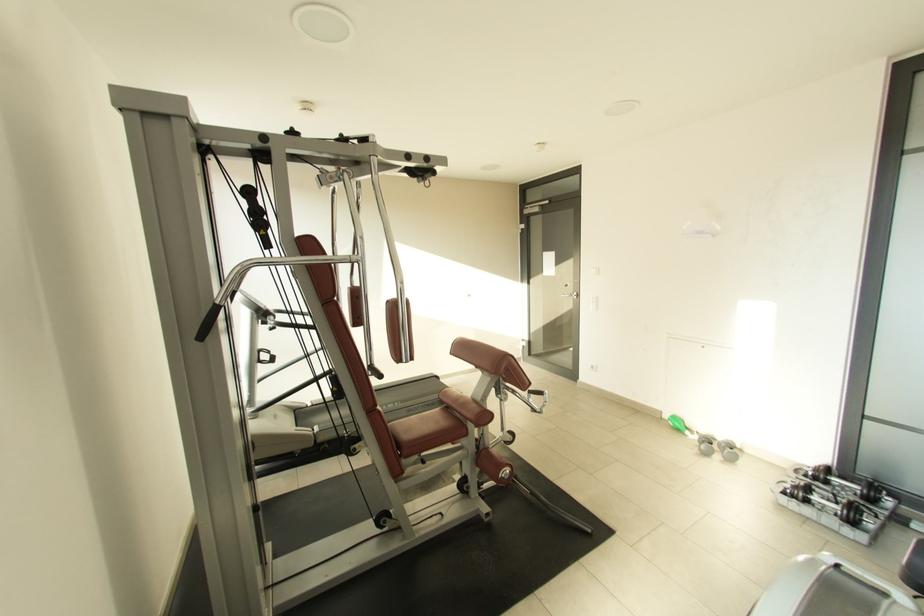
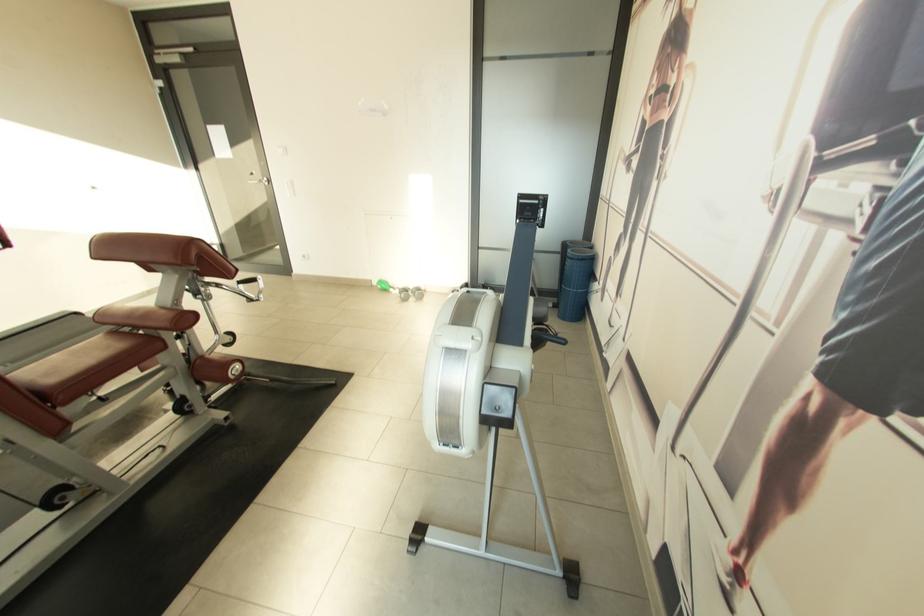
Locate, in the second image, the point that corresponds to point (699, 431) in the first image.

(400, 288)